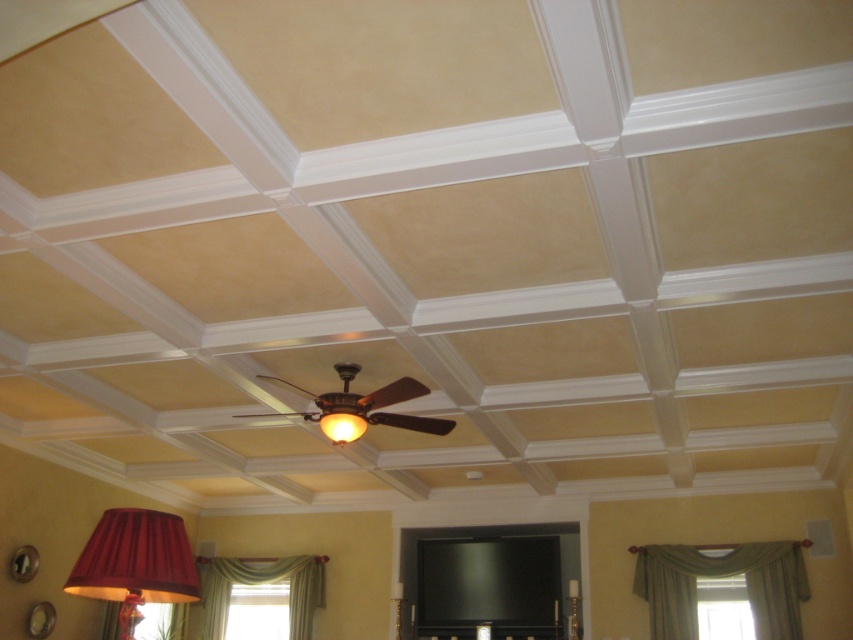
Question: Is green fabric curtain at lower right to the left of matte gold lampshade at center from the viewer's perspective?

Choices:
 (A) yes
 (B) no

Answer: (B)

Question: Is green fabric curtain at lower left thinner than matte gold lampshade at center?

Choices:
 (A) no
 (B) yes

Answer: (A)

Question: Can you confirm if green fabric curtain at lower left is thinner than wooden ceiling fan at center?

Choices:
 (A) yes
 (B) no

Answer: (A)

Question: Based on their relative distances, which object is nearer to the green fabric curtain at lower left?

Choices:
 (A) green fabric curtain at lower right
 (B) matte red lampshade at lower left
 (C) wooden ceiling fan at center

Answer: (A)

Question: Which point is closer to the camera?

Choices:
 (A) matte gold lampshade at center
 (B) wooden ceiling fan at center
 (C) green fabric curtain at lower left

Answer: (B)

Question: Among these objects, which one is farthest from the camera?

Choices:
 (A) matte red lampshade at lower left
 (B) matte gold lampshade at center

Answer: (B)